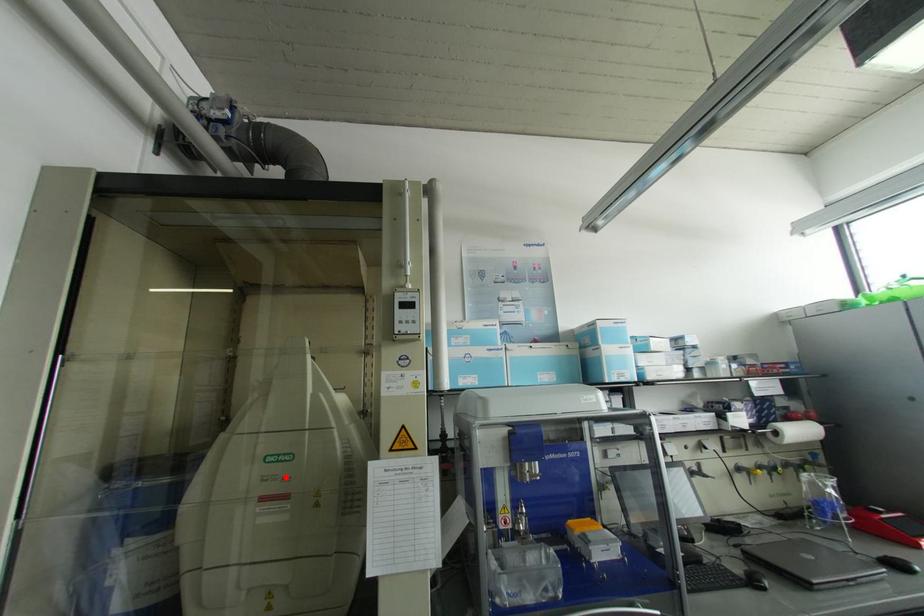
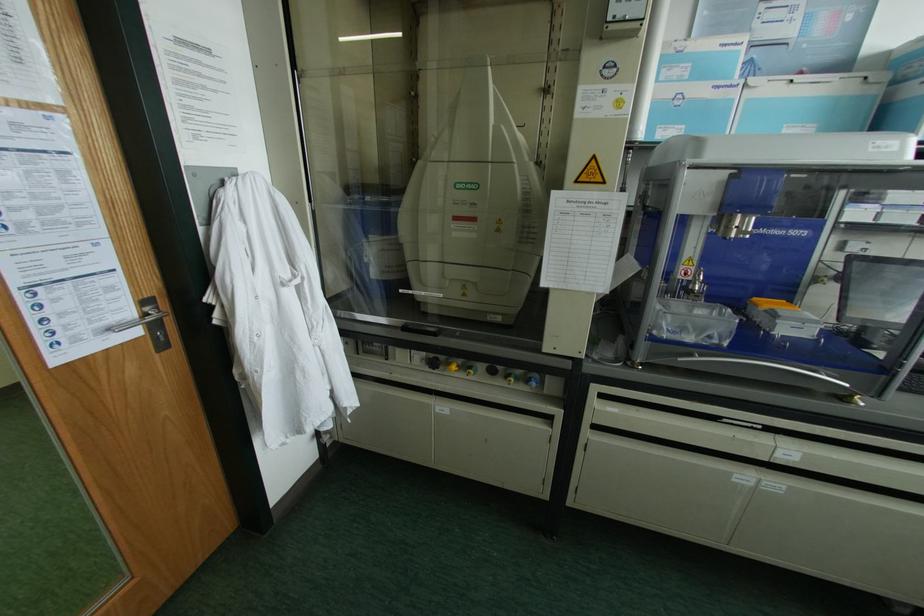
Find the pixel in the second image that matches the highlighted location in the first image.

(472, 204)